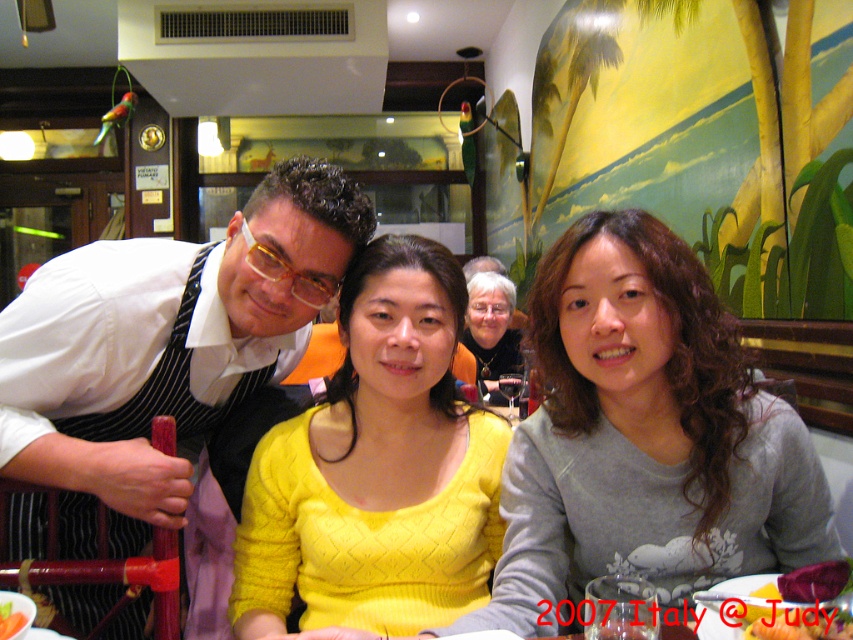
You are a customer at the restaurant and want to choose between the beetroot smoothie at lower right and the smooth tomato at center. Which one has a larger size?

The beetroot smoothie at lower right is bigger than the smooth tomato at center, so the beetroot smoothie at lower right has a larger size.

In the scene described, there are two beverages present. The beetroot smoothie at lower right and the smooth tomato at center. From the perspective of someone standing in front of the table, which beverage is positioned to the right of the other?

The beetroot smoothie at lower right is to the right of the smooth tomato at center.

You are a photographer trying to capture a clear shot of both the white shirt at left and the smooth tomato at center. Which object will appear larger in your photo?

The white shirt at left will appear larger in the photo because it is closer to the viewer than the smooth tomato at center.